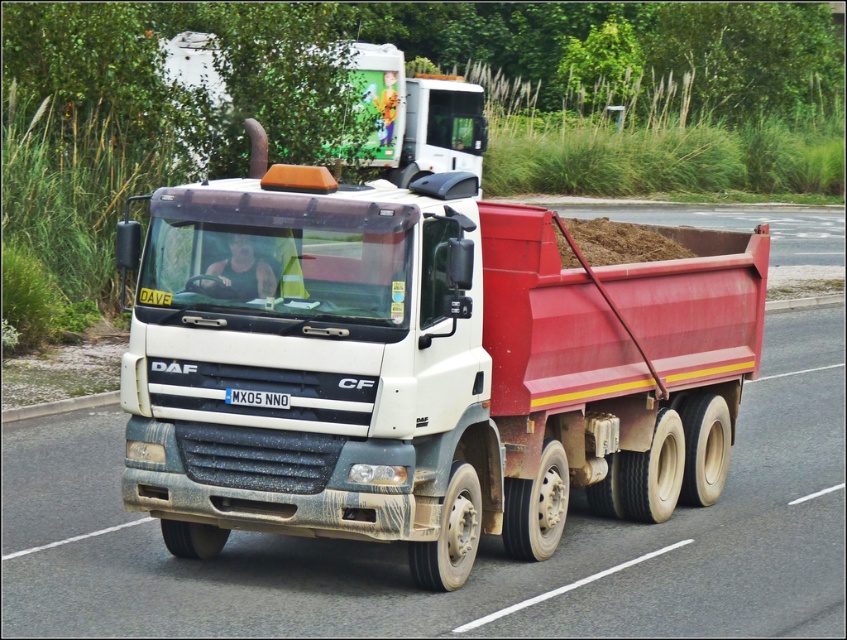
You are a traffic officer checking vehicle dimensions. The white matte truck at upper center and the black plastic license plate at center are in your view. Which object is wider?

The white matte truck at upper center is wider than the black plastic license plate at center.

Consider the image. You are a delivery driver who needs to park your dull white trailer truck at center precisely at a loading dock 25 feet away. Based on the image, can you safely park the truck at the loading dock without overextending?

The dull white trailer truck at center is 25.57 feet away from the camera, which is slightly farther than the 25 feet required for the loading dock. Therefore, you can safely park the truck without overextending as the distance is sufficient.